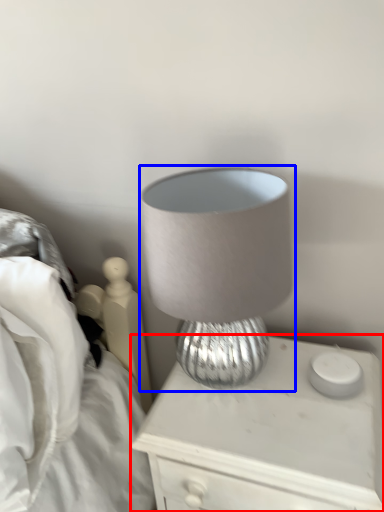
Question: Which object is further to the camera taking this photo, nightstand (highlighted by a red box) or lamp (highlighted by a blue box)?

Choices:
 (A) nightstand
 (B) lamp

Answer: (A)